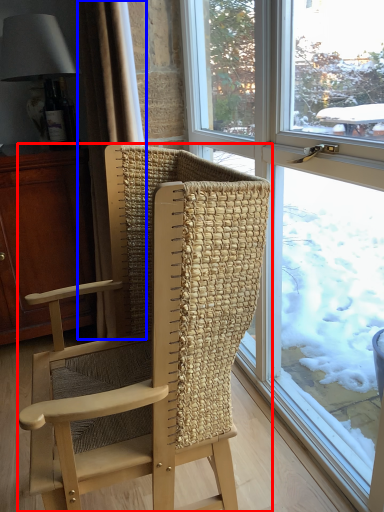
Question: Which object appears closest to the camera in this image, chair (highlighted by a red box) or curtain (highlighted by a blue box)?

Choices:
 (A) chair
 (B) curtain

Answer: (A)